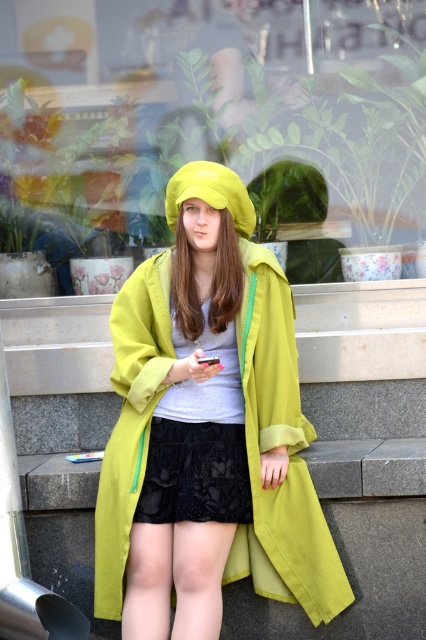
Question: Which point is farther to the camera?

Choices:
 (A) (186, 493)
 (B) (126, 90)

Answer: (B)

Question: Does transparent glass shop window at center appear on the right side of black lace shorts at center?

Choices:
 (A) no
 (B) yes

Answer: (B)

Question: Which object is farther from the camera taking this photo?

Choices:
 (A) black lace shorts at center
 (B) transparent glass shop window at center

Answer: (B)

Question: Among these points, which one is farthest from the camera?

Choices:
 (A) (198, 486)
 (B) (370, 237)

Answer: (B)

Question: Does transparent glass shop window at center appear under matte green coat at center?

Choices:
 (A) no
 (B) yes

Answer: (A)

Question: Can you confirm if matte green coat at center is positioned above black lace shorts at center?

Choices:
 (A) no
 (B) yes

Answer: (B)